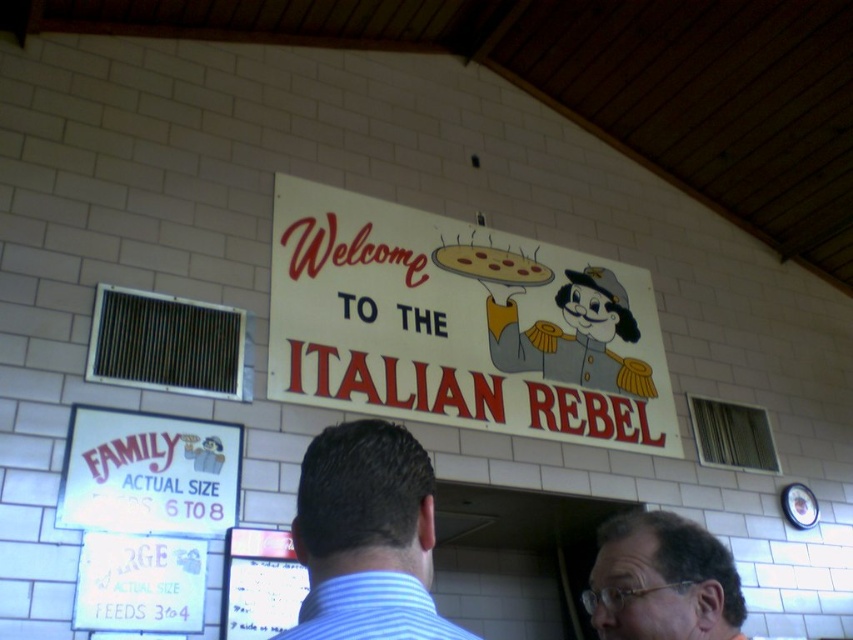
Is point (563, 433) positioned behind point (316, 525)?

Yes, point (563, 433) is behind point (316, 525).

From the picture: Can you confirm if white cardboard sign at center is positioned above blue striped shirt at center?

Yes, white cardboard sign at center is above blue striped shirt at center.

Does point (389, 273) lie in front of point (418, 531)?

No.

Identify the location of white cardboard sign at center. (457, 326).

Which of these two, blue striped shirt at center or matte yellow pizza at center, stands shorter?

matte yellow pizza at center

I want to click on blue striped shirt at center, so click(x=366, y=536).

Which is in front, point (328, 477) or point (604, 596)?

Point (328, 477) is in front.

Is point (426, 560) positioned in front of point (602, 529)?

Yes, it is.

Image resolution: width=853 pixels, height=640 pixels. What are the coordinates of `blue striped shirt at center` in the screenshot? It's located at (366, 536).